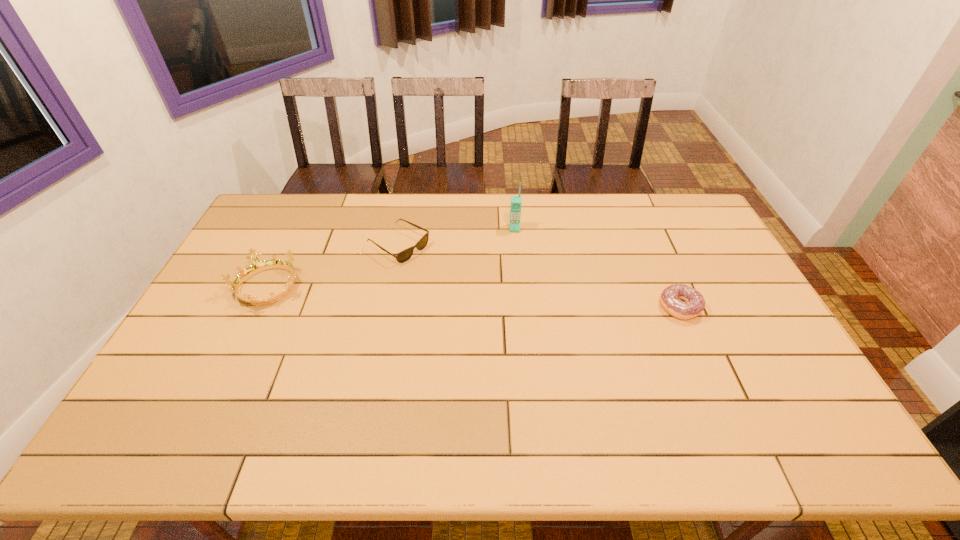
Identify the location of the third shortest object. The image size is (960, 540). (257, 266).

The image size is (960, 540). What are the coordinates of `the leftmost object` in the screenshot? It's located at (257, 266).

This screenshot has width=960, height=540. In order to click on doughnut in this screenshot , I will do `click(671, 297)`.

I want to click on cellular telephone, so click(516, 201).

Locate an element on the screen. The image size is (960, 540). the tallest object is located at coordinates (516, 201).

Find the location of a particular element. The image size is (960, 540). the third object from right to left is located at coordinates (403, 256).

At what (x,y) coordinates should I click in order to perform the action: click on vacant space located on the back of the crown. Please return your answer as a coordinate pair (x, y). Looking at the image, I should click on (289, 242).

Locate an element on the screen. vacant space situated 0.260m on the front of the rightmost object is located at coordinates (722, 404).

I want to click on free spot located on the keypad of the cellular telephone, so click(514, 315).

The width and height of the screenshot is (960, 540). In order to click on blank space located on the keypad of the cellular telephone in this screenshot , I will do `click(514, 280)`.